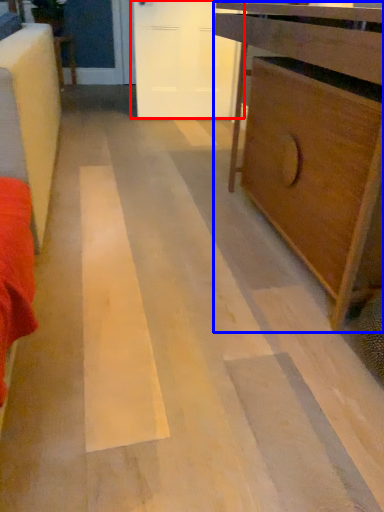
Question: Which point is further to the camera, door (highlighted by a red box) or chest of drawers (highlighted by a blue box)?

Choices:
 (A) door
 (B) chest of drawers

Answer: (A)